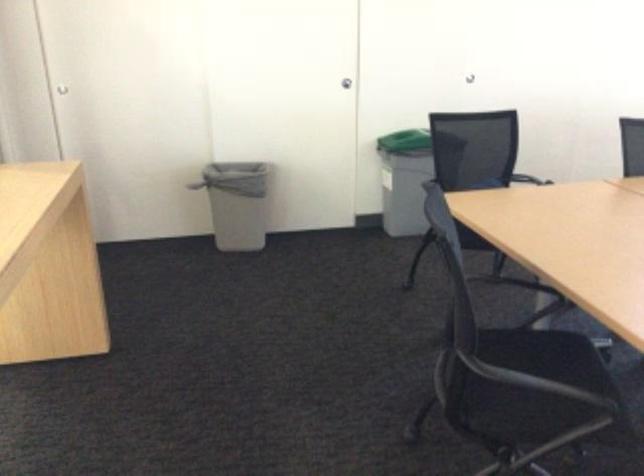
What do you see at coordinates (542, 347) in the screenshot? I see `a chair sitting surface` at bounding box center [542, 347].